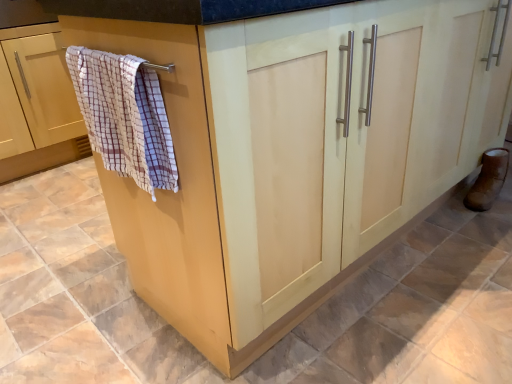
Question: Are checkered fabric bath towel at left and brown leather boot at lower right far apart?

Choices:
 (A) no
 (B) yes

Answer: (B)

Question: From a real-world perspective, is checkered fabric bath towel at left positioned under brown leather boot at lower right based on gravity?

Choices:
 (A) yes
 (B) no

Answer: (B)

Question: From a real-world perspective, does checkered fabric bath towel at left stand above brown leather boot at lower right?

Choices:
 (A) no
 (B) yes

Answer: (B)

Question: Can you confirm if checkered fabric bath towel at left is bigger than brown leather boot at lower right?

Choices:
 (A) yes
 (B) no

Answer: (A)

Question: Does checkered fabric bath towel at left come behind brown leather boot at lower right?

Choices:
 (A) no
 (B) yes

Answer: (A)

Question: Can you confirm if checkered fabric bath towel at left is thinner than brown leather boot at lower right?

Choices:
 (A) yes
 (B) no

Answer: (B)

Question: Can you confirm if checkered fabric bath towel at left is positioned to the right of beige wood towel rack at left?

Choices:
 (A) no
 (B) yes

Answer: (B)

Question: Is checkered fabric bath towel at left outside of beige wood towel rack at left?

Choices:
 (A) no
 (B) yes

Answer: (B)

Question: Is the surface of checkered fabric bath towel at left in direct contact with beige wood towel rack at left?

Choices:
 (A) yes
 (B) no

Answer: (B)

Question: From the image's perspective, is checkered fabric bath towel at left located above beige wood towel rack at left?

Choices:
 (A) no
 (B) yes

Answer: (A)

Question: Is checkered fabric bath towel at left wider than beige wood towel rack at left?

Choices:
 (A) yes
 (B) no

Answer: (B)

Question: From a real-world perspective, is checkered fabric bath towel at left located higher than beige wood towel rack at left?

Choices:
 (A) no
 (B) yes

Answer: (B)

Question: Does beige wood towel rack at left touch checkered fabric bath towel at left?

Choices:
 (A) no
 (B) yes

Answer: (A)